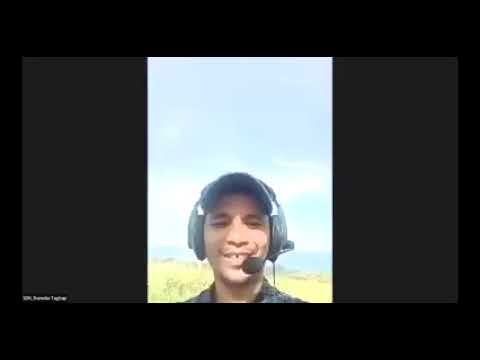
You are a GUI agent. You are given a task and a screenshot of the screen. Output one action in this format:
    pyautogui.click(x=<x>, y=<y>)
    Task: Click on the mic
    
    Given the screenshot: What is the action you would take?
    pyautogui.click(x=254, y=268)